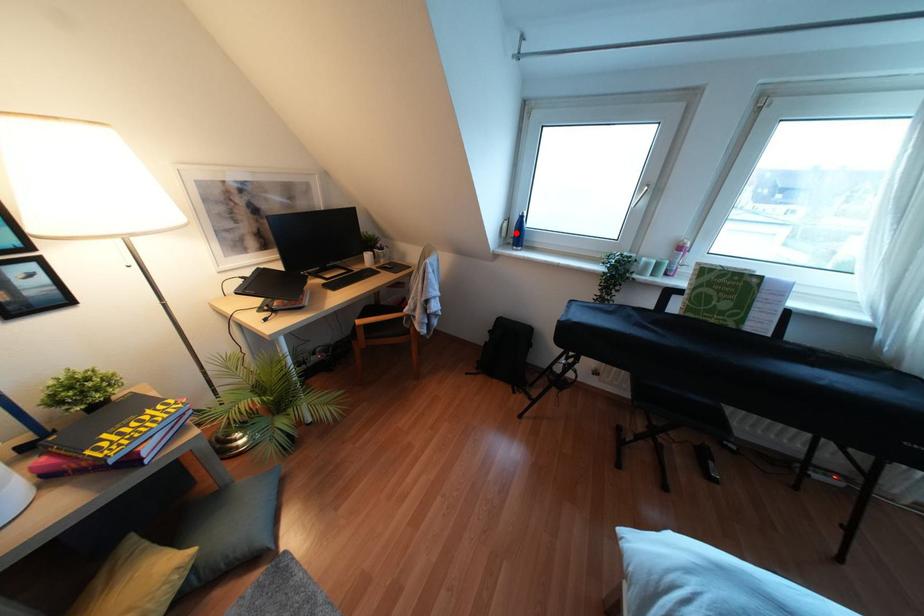
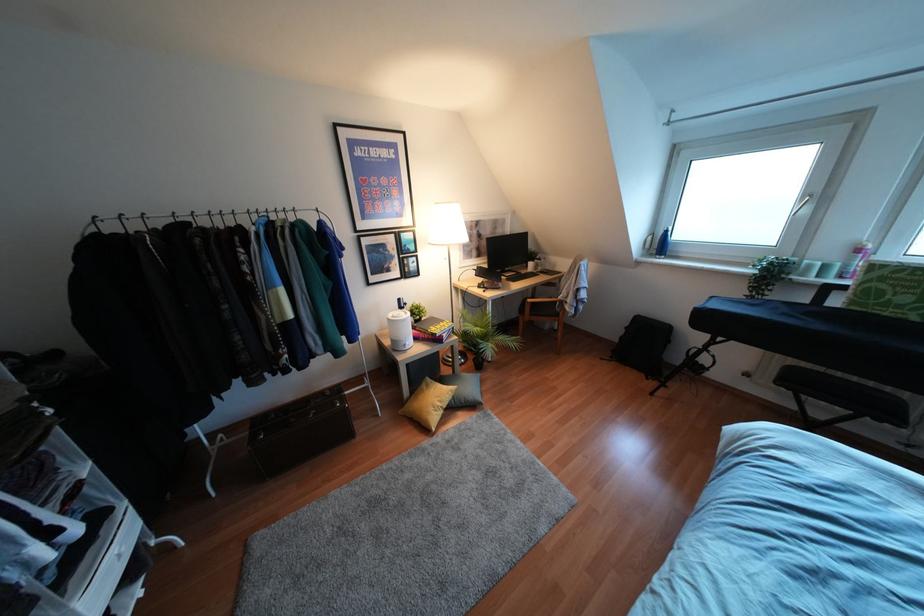
In the second image, find the point that corresponds to the highlighted location in the first image.

(660, 245)